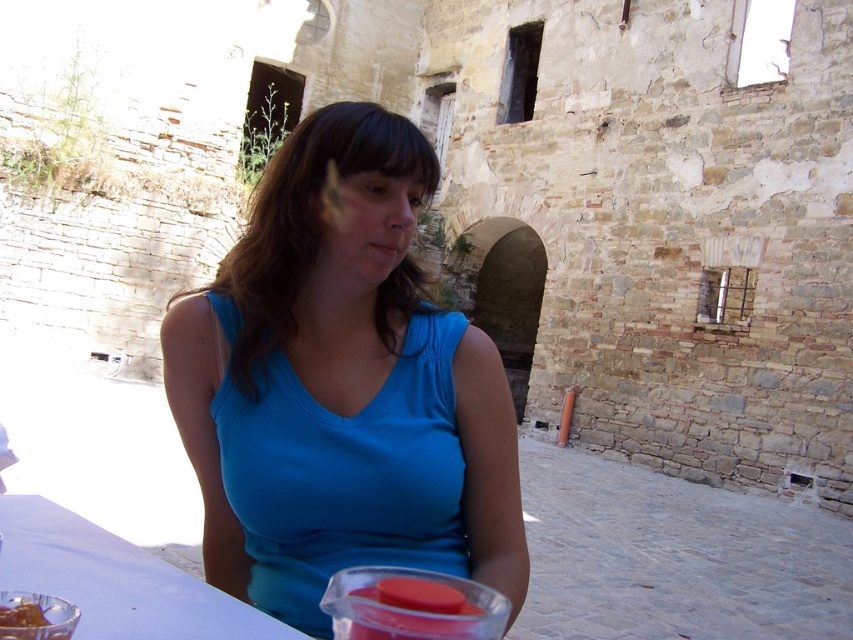
Question: Which point is closer to the camera taking this photo?

Choices:
 (A) (28, 621)
 (B) (230, 621)

Answer: (A)

Question: Estimate the real-world distances between objects in this image. Which object is closer to the white matte table at lower left?

Choices:
 (A) translucent plastic cup at lower center
 (B) blue fabric shirt at center

Answer: (A)

Question: Can you confirm if blue fabric shirt at center is positioned to the right of white matte table at lower left?

Choices:
 (A) yes
 (B) no

Answer: (B)

Question: Observing the image, what is the correct spatial positioning of white matte table at lower left in reference to translucent plastic cup at lower center?

Choices:
 (A) right
 (B) left

Answer: (B)

Question: Is translucent plastic cup at lower center positioned at the back of shiny brown chocolate at lower left?

Choices:
 (A) no
 (B) yes

Answer: (B)

Question: Among these objects, which one is nearest to the camera?

Choices:
 (A) translucent plastic cup at lower center
 (B) blue fabric shirt at center
 (C) shiny brown chocolate at lower left

Answer: (C)